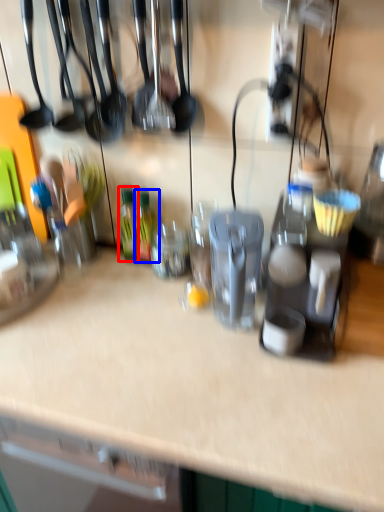
Question: Which point is further to the camera, bottle (highlighted by a red box) or bottle (highlighted by a blue box)?

Choices:
 (A) bottle
 (B) bottle

Answer: (A)